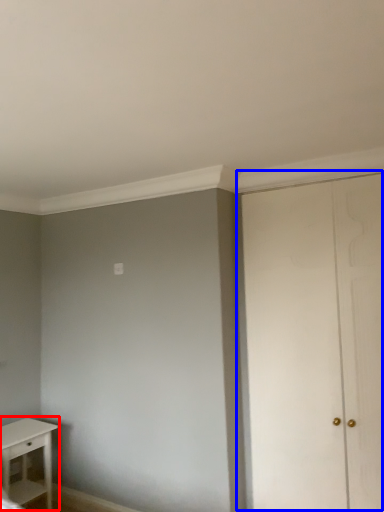
Question: Among these objects, which one is farthest to the camera, table (highlighted by a red box) or door (highlighted by a blue box)?

Choices:
 (A) table
 (B) door

Answer: (A)